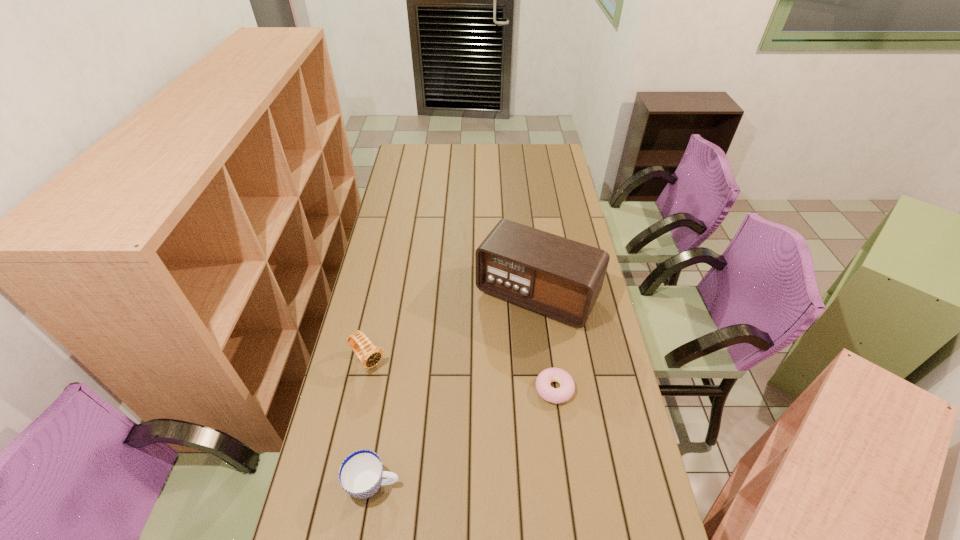
Identify the location of free spot on the desktop that is between the cup and the shortest object and is positioned on the face of the second tallest object. (446, 446).

Where is `free space on the desktop that is between the nearest object and the doughnut and is positioned on the front-facing side of the farthest object`? This screenshot has height=540, width=960. free space on the desktop that is between the nearest object and the doughnut and is positioned on the front-facing side of the farthest object is located at coordinates (447, 445).